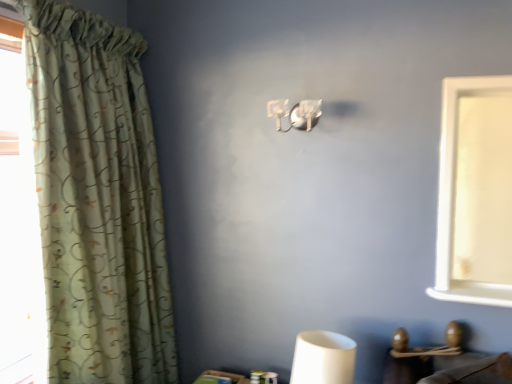
What do you see at coordinates (295, 113) in the screenshot?
I see `satin silver sconce at upper center` at bounding box center [295, 113].

Image resolution: width=512 pixels, height=384 pixels. Identify the location of satin silver sconce at upper center. (295, 113).

What do you see at coordinates (98, 200) in the screenshot? This screenshot has height=384, width=512. I see `green floral fabric curtain at left` at bounding box center [98, 200].

You are a GUI agent. You are given a task and a screenshot of the screen. Output one action in this format:
    pyautogui.click(x=<x>, y=<y>)
    Task: Click on the green floral fabric curtain at left
    
    Given the screenshot: What is the action you would take?
    pyautogui.click(x=98, y=200)

Find the location of a particular element. The image size is (512, 384). satin silver sconce at upper center is located at coordinates (295, 113).

Between satin silver sconce at upper center and green floral fabric curtain at left, which one appears on the right side from the viewer's perspective?

Positioned to the right is satin silver sconce at upper center.

Is the depth of satin silver sconce at upper center less than that of green floral fabric curtain at left?

No.

Is point (293, 109) positioned behind point (117, 84)?

No, (293, 109) is in front of (117, 84).

From the image's perspective, does satin silver sconce at upper center appear lower than green floral fabric curtain at left?

No, from the image's perspective, satin silver sconce at upper center is not below green floral fabric curtain at left.

From a real-world perspective, which object rests below the other?

green floral fabric curtain at left is physically lower.

Considering the relative sizes of satin silver sconce at upper center and green floral fabric curtain at left in the image provided, is satin silver sconce at upper center thinner than green floral fabric curtain at left?

Yes, satin silver sconce at upper center is thinner than green floral fabric curtain at left.

Considering the relative sizes of satin silver sconce at upper center and green floral fabric curtain at left in the image provided, is satin silver sconce at upper center taller than green floral fabric curtain at left?

No, satin silver sconce at upper center is not taller than green floral fabric curtain at left.

Considering the relative sizes of satin silver sconce at upper center and green floral fabric curtain at left in the image provided, is satin silver sconce at upper center bigger than green floral fabric curtain at left?

Actually, satin silver sconce at upper center might be smaller than green floral fabric curtain at left.

Is satin silver sconce at upper center inside or outside of green floral fabric curtain at left?

satin silver sconce at upper center lies outside green floral fabric curtain at left.

Are satin silver sconce at upper center and green floral fabric curtain at left far apart?

No, there isn't a large distance between satin silver sconce at upper center and green floral fabric curtain at left.

Is satin silver sconce at upper center facing towards green floral fabric curtain at left?

No.

Measure the distance from satin silver sconce at upper center to green floral fabric curtain at left.

satin silver sconce at upper center is 34.40 inches from green floral fabric curtain at left.

You are a GUI agent. You are given a task and a screenshot of the screen. Output one action in this format:
    pyautogui.click(x=<x>, y=<y>)
    Task: Click on the lamp behind the green floral fabric curtain at left
    The width and height of the screenshot is (512, 384).
    Given the screenshot: What is the action you would take?
    pyautogui.click(x=295, y=113)

Considering the positions of objects green floral fabric curtain at left and satin silver sconce at upper center in the image provided, who is more to the right, green floral fabric curtain at left or satin silver sconce at upper center?

From the viewer's perspective, satin silver sconce at upper center appears more on the right side.

In the image, is green floral fabric curtain at left positioned in front of or behind satin silver sconce at upper center?

green floral fabric curtain at left is positioned closer to the viewer than satin silver sconce at upper center.

Which is closer, (65,312) or (277,119)?

The point (65,312) is closer to the camera.

From the image's perspective, is green floral fabric curtain at left positioned above or below satin silver sconce at upper center?

From the image's perspective, green floral fabric curtain at left appears below satin silver sconce at upper center.

From a real-world perspective, who is located higher, green floral fabric curtain at left or satin silver sconce at upper center?

In real-world perspective, satin silver sconce at upper center is above.

Which object is wider, green floral fabric curtain at left or satin silver sconce at upper center?

Wider between the two is green floral fabric curtain at left.

Between green floral fabric curtain at left and satin silver sconce at upper center, which one has more height?

Standing taller between the two is green floral fabric curtain at left.

Does green floral fabric curtain at left have a larger size compared to satin silver sconce at upper center?

Correct, green floral fabric curtain at left is larger in size than satin silver sconce at upper center.

Would you say satin silver sconce at upper center is part of green floral fabric curtain at left's contents?

Actually, satin silver sconce at upper center is outside green floral fabric curtain at left.

Is the surface of green floral fabric curtain at left in direct contact with satin silver sconce at upper center?

There is a gap between green floral fabric curtain at left and satin silver sconce at upper center.

In the scene shown: Is green floral fabric curtain at left turned away from satin silver sconce at upper center?

green floral fabric curtain at left does not have its back to satin silver sconce at upper center.

From the picture: Can you tell me how much green floral fabric curtain at left and satin silver sconce at upper center differ in facing direction?

They differ by 89.3 degrees in their facing directions.

Image resolution: width=512 pixels, height=384 pixels. I want to click on lamp above the green floral fabric curtain at left (from the image's perspective), so click(295, 113).

In the image, there is a satin silver sconce at upper center. Identify the location of curtain below it (from the image's perspective). (98, 200).

At what (x,y) coordinates should I click in order to perform the action: click on lamp above the green floral fabric curtain at left (from the image's perspective). Please return your answer as a coordinate pair (x, y). Looking at the image, I should click on (295, 113).